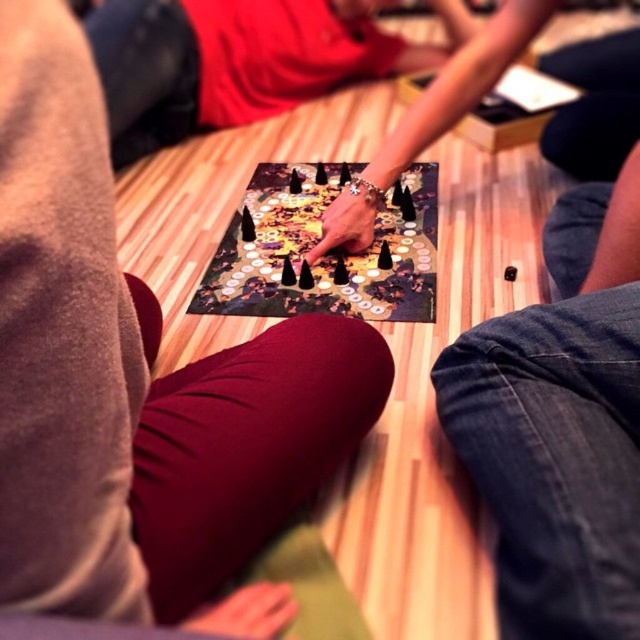
Question: Can you confirm if smooth black hand at center is positioned to the right of denim pants at lower right?

Choices:
 (A) no
 (B) yes

Answer: (A)

Question: Does denim pants at lower right appear on the right side of smooth red shirt at center?

Choices:
 (A) yes
 (B) no

Answer: (A)

Question: Which object is closer to the camera taking this photo?

Choices:
 (A) smooth black hand at center
 (B) denim pants at lower right
 (C) black plastic board game at center
 (D) smooth red shirt at center

Answer: (A)

Question: Is smooth black hand at center above black plastic board game at center?

Choices:
 (A) no
 (B) yes

Answer: (A)

Question: Which point appears farthest from the camera in this image?

Choices:
 (A) (531, 444)
 (B) (456, 28)

Answer: (B)

Question: Among these points, which one is farthest from the camera?

Choices:
 (A) (317, 291)
 (B) (604, 272)

Answer: (A)